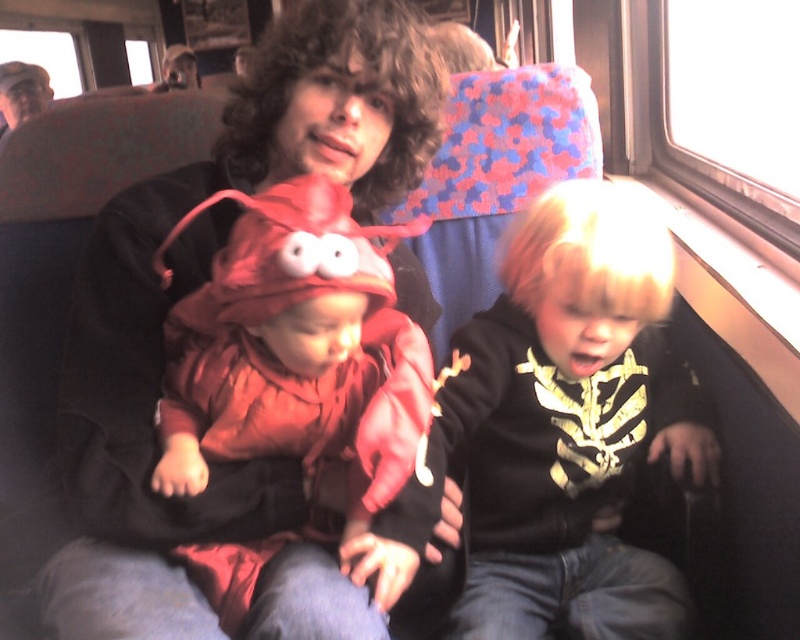
Is black velvet sweater at right above rubber lobster at center?

Incorrect, black velvet sweater at right is not positioned above rubber lobster at center.

Is point (596, 180) more distant than point (270, 548)?

Yes, point (596, 180) is behind point (270, 548).

Between point (644, 634) and point (268, 333), which one is positioned in front?

Point (268, 333) is in front.

Identify the location of black velvet sweater at right. (558, 432).

Between rubber lobster at center and matte black cap at upper left, which one appears on the right side from the viewer's perspective?

rubber lobster at center

Does rubber lobster at center appear over matte black cap at upper left?

No.

Where is `rubber lobster at center`? rubber lobster at center is located at coordinates 292,368.

Who is shorter, black velvet sweater at right or matte black cap at upper left?

Standing shorter between the two is matte black cap at upper left.

Describe the element at coordinates (558, 432) in the screenshot. I see `black velvet sweater at right` at that location.

Is point (500, 266) farther from viewer compared to point (30, 109)?

No, (500, 266) is closer to viewer.

Where is `black velvet sweater at right`? The width and height of the screenshot is (800, 640). black velvet sweater at right is located at coordinates (558, 432).